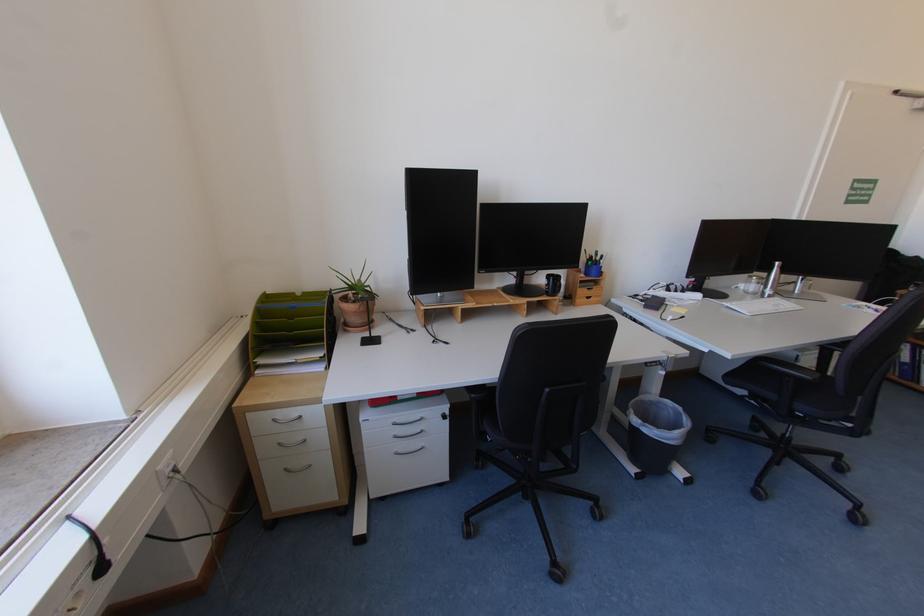
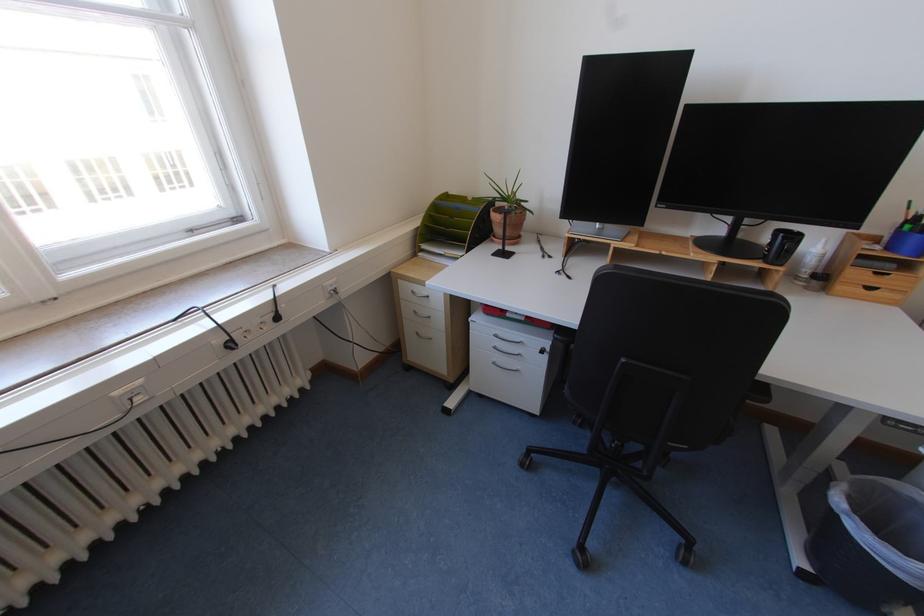
In the second image, find the point that corresponds to the point at 647,472 in the first image.

(819, 572)